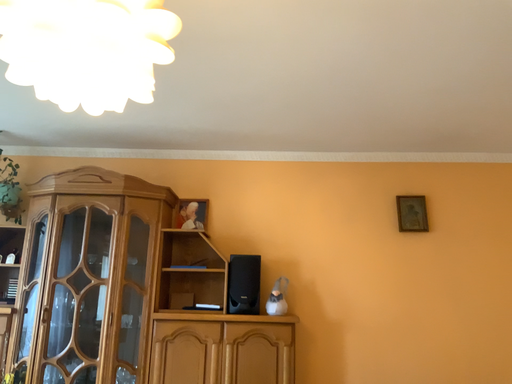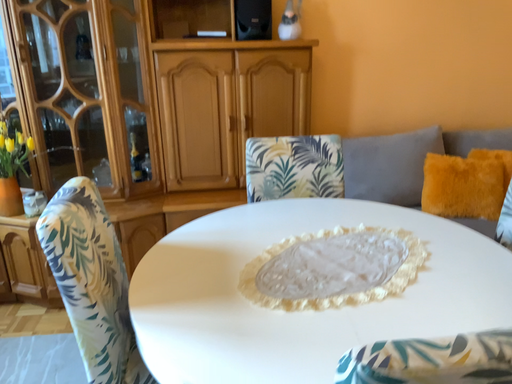
Question: How did the camera likely rotate when shooting the video?

Choices:
 (A) rotated left
 (B) rotated right

Answer: (B)